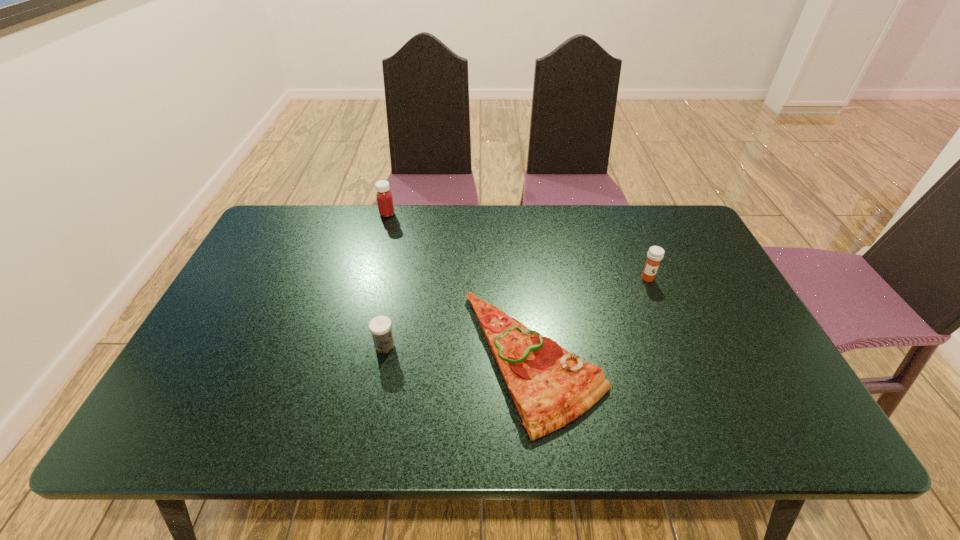
Find the location of a particular element. Image resolution: width=960 pixels, height=540 pixels. vacant space located on the front of the nearest medicine is located at coordinates (379, 375).

Find the location of a particular element. The width and height of the screenshot is (960, 540). free spot located 0.200m on the back of the pizza is located at coordinates (522, 251).

This screenshot has width=960, height=540. What are the coordinates of `object present at the far edge` in the screenshot? It's located at (384, 197).

This screenshot has width=960, height=540. Find the location of `object that is at the near edge`. object that is at the near edge is located at coordinates (550, 387).

The image size is (960, 540). What are the coordinates of `vacant space at the far edge of the desktop` in the screenshot? It's located at (x=388, y=228).

Where is `free region at the near edge of the desktop`? This screenshot has height=540, width=960. free region at the near edge of the desktop is located at coordinates (351, 430).

Where is `free region at the left edge of the desktop`? The image size is (960, 540). free region at the left edge of the desktop is located at coordinates (276, 254).

Identify the location of vacant space at the far left corner of the desktop. point(303,234).

You are a GUI agent. You are given a task and a screenshot of the screen. Output one action in this format:
    pyautogui.click(x=<x>, y=<y>)
    Task: Click on the vacant space at the far right corner of the desktop
    Image resolution: width=960 pixels, height=540 pixels.
    Given the screenshot: What is the action you would take?
    click(651, 246)

In the image, there is a desktop. Identify the location of free space at the near right corner. (791, 405).